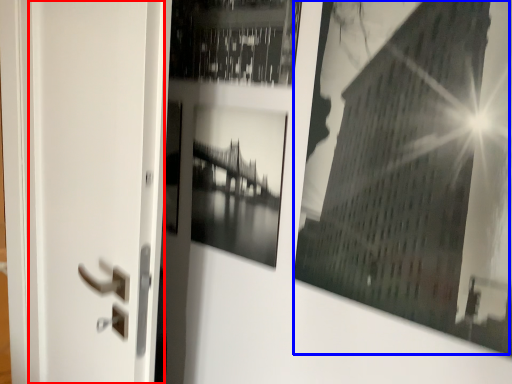
Question: Which of the following is the farthest to the observer, screen door (highlighted by a red box) or picture frame (highlighted by a blue box)?

Choices:
 (A) screen door
 (B) picture frame

Answer: (A)